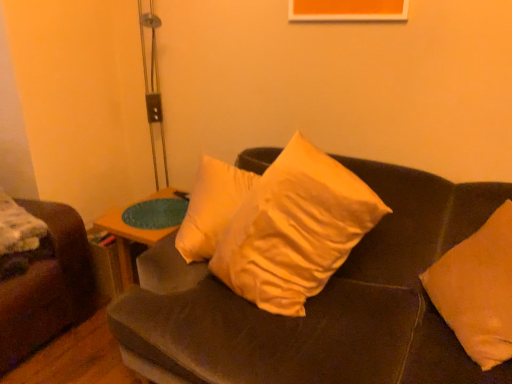
Question: Based on their sizes in the image, would you say woodenwoodentable at center is bigger or smaller than metallic silver table lamp at upper left?

Choices:
 (A) small
 (B) big

Answer: (A)

Question: From the image's perspective, relative to metallic silver table lamp at upper left, is woodenwoodentable at center above or below?

Choices:
 (A) below
 (B) above

Answer: (A)

Question: Which of these objects is positioned closest to the orange fabric pillow at right, positioned as the second pillow in left-to-right order?

Choices:
 (A) soft yellow pillow at center, the first pillow viewed from the left
 (B) velvet brown couch at center
 (C) metallic silver table lamp at upper left
 (D) woodenwoodentable at center

Answer: (B)

Question: Based on their relative distances, which object is farther from the velvet brown couch at center?

Choices:
 (A) woodenwoodentable at center
 (B) metallic silver table lamp at upper left
 (C) soft yellow pillow at center, placed as the 2th pillow when sorted from right to left
 (D) orange fabric pillow at right, positioned as the second pillow in left-to-right order

Answer: (B)